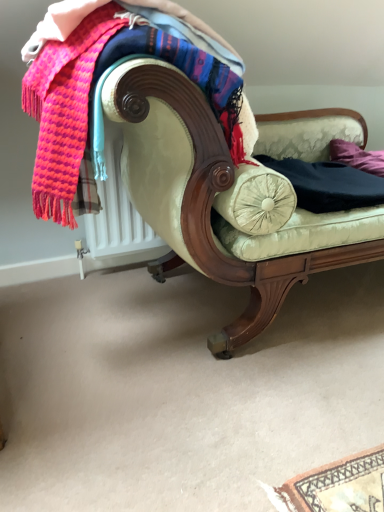
This screenshot has height=512, width=384. Describe the element at coordinates (200, 191) in the screenshot. I see `velvet cream couch at center` at that location.

Where is `knitted wool scarf at upper left`? The image size is (384, 512). knitted wool scarf at upper left is located at coordinates (92, 89).

Locate an element on the screen. The height and width of the screenshot is (512, 384). velvet cream couch at center is located at coordinates 200,191.

Is knitted wool scarf at upper left thinner than black cotton pants at center?

Yes.

Where is `clothing behind the knitted wool scarf at upper left`? This screenshot has height=512, width=384. clothing behind the knitted wool scarf at upper left is located at coordinates (328, 184).

How far apart are knitted wool scarf at upper left and black cotton pants at center?

21.30 inches.

Could you tell me if purple fabric pillow at right is facing black cotton pants at center?

No, purple fabric pillow at right is not facing towards black cotton pants at center.

Between point (348, 158) and point (325, 202), which one is positioned in front?

The point (325, 202) is closer to the camera.

How many degrees apart are the facing directions of purple fabric pillow at right and black cotton pants at center?

There is a 0.000144-degree angle between the facing directions of purple fabric pillow at right and black cotton pants at center.

Considering the relative sizes of purple fabric pillow at right and black cotton pants at center in the image provided, is purple fabric pillow at right wider than black cotton pants at center?

No.

Consider the image. Are black cotton pants at center and velvet cream couch at center far apart?

No, black cotton pants at center is not far from velvet cream couch at center.

From the picture: Which of these two, black cotton pants at center or velvet cream couch at center, stands taller?

velvet cream couch at center is taller.

From the picture: Is black cotton pants at center spatially inside velvet cream couch at center, or outside of it?

black cotton pants at center lies within the bounds of velvet cream couch at center.

From the image's perspective, is purple fabric pillow at right positioned above or below velvet cream couch at center?

From the image's perspective, purple fabric pillow at right appears above velvet cream couch at center.

Is purple fabric pillow at right at the right side of velvet cream couch at center?

Indeed, purple fabric pillow at right is positioned on the right side of velvet cream couch at center.

Is purple fabric pillow at right oriented towards velvet cream couch at center?

Yes, purple fabric pillow at right is oriented towards velvet cream couch at center.

In the scene shown: Would you say purple fabric pillow at right is inside or outside velvet cream couch at center?

purple fabric pillow at right is inside velvet cream couch at center.

Does knitted wool scarf at upper left contain purple fabric pillow at right?

No, purple fabric pillow at right is not a part of knitted wool scarf at upper left.

From a real-world perspective, which is physically below, knitted wool scarf at upper left or purple fabric pillow at right?

purple fabric pillow at right is physically lower.

Is knitted wool scarf at upper left oriented towards purple fabric pillow at right?

No.

Identify the location of laundry in front of the purple fabric pillow at right. The width and height of the screenshot is (384, 512). (92, 89).

Considering the relative sizes of purple fabric pillow at right and knitted wool scarf at upper left in the image provided, is purple fabric pillow at right wider than knitted wool scarf at upper left?

No, purple fabric pillow at right is not wider than knitted wool scarf at upper left.

Between purple fabric pillow at right and knitted wool scarf at upper left, which one has more height?

knitted wool scarf at upper left is taller.

Would you say black cotton pants at center contains knitted wool scarf at upper left?

No, knitted wool scarf at upper left is located outside of black cotton pants at center.

Which of these two, black cotton pants at center or knitted wool scarf at upper left, is wider?

With larger width is black cotton pants at center.

Considering the points (270, 164) and (74, 51), which point is behind, point (270, 164) or point (74, 51)?

Positioned behind is point (270, 164).

From the picture: Considering the positions of objects black cotton pants at center and knitted wool scarf at upper left in the image provided, who is more to the left, black cotton pants at center or knitted wool scarf at upper left?

knitted wool scarf at upper left.

In the image, there is a knitted wool scarf at upper left. Where is `clothing below it (from the image's perspective)`? The width and height of the screenshot is (384, 512). clothing below it (from the image's perspective) is located at coordinates (328, 184).

Identify the location of pillow above the black cotton pants at center (from a real-world perspective). The height and width of the screenshot is (512, 384). (357, 157).

From the image, which object appears to be nearer to velvet cream couch at center, knitted wool scarf at upper left or black cotton pants at center?

Among the two, knitted wool scarf at upper left is located nearer to velvet cream couch at center.

From the image, which object appears to be farther from velvet cream couch at center, purple fabric pillow at right or black cotton pants at center?

Based on the image, purple fabric pillow at right appears to be further to velvet cream couch at center.

When comparing their distances from knitted wool scarf at upper left, does velvet cream couch at center or purple fabric pillow at right seem closer?

Among the two, velvet cream couch at center is located nearer to knitted wool scarf at upper left.

Which object lies nearer to the anchor point knitted wool scarf at upper left, purple fabric pillow at right or velvet cream couch at center?

The object closer to knitted wool scarf at upper left is velvet cream couch at center.

Looking at the image, which one is located closer to purple fabric pillow at right, black cotton pants at center or knitted wool scarf at upper left?

The object closer to purple fabric pillow at right is black cotton pants at center.

Which object lies nearer to the anchor point velvet cream couch at center, knitted wool scarf at upper left or purple fabric pillow at right?

knitted wool scarf at upper left is closer to velvet cream couch at center.

Looking at the image, which one is located further to knitted wool scarf at upper left, black cotton pants at center or velvet cream couch at center?

black cotton pants at center is positioned further to the anchor knitted wool scarf at upper left.

Estimate the real-world distances between objects in this image. Which object is closer to black cotton pants at center, velvet cream couch at center or knitted wool scarf at upper left?

velvet cream couch at center is positioned closer to the anchor black cotton pants at center.

In order to click on studio couch located between knitted wool scarf at upper left and purple fabric pillow at right in the left-right direction in this screenshot , I will do `click(200, 191)`.

Image resolution: width=384 pixels, height=512 pixels. I want to click on clothing between knitted wool scarf at upper left and purple fabric pillow at right from left to right, so click(328, 184).

Identify the location of clothing between knitted wool scarf at upper left and velvet cream couch at center from left to right. (328, 184).

Image resolution: width=384 pixels, height=512 pixels. Find the location of `clothing between velvet cream couch at center and purple fabric pillow at right along the z-axis`. clothing between velvet cream couch at center and purple fabric pillow at right along the z-axis is located at coordinates (328, 184).